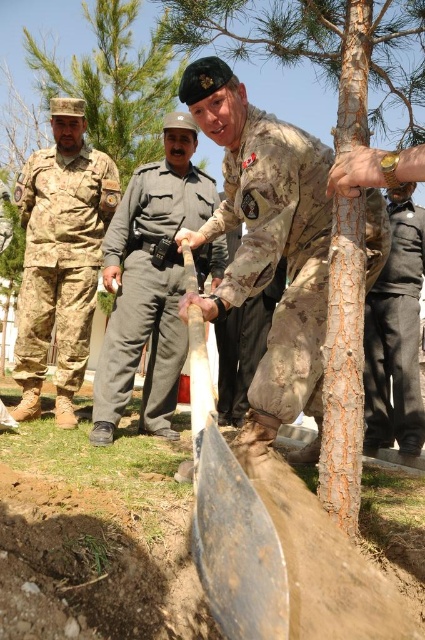
From the picture: Is green textured tree at center positioned at the back of dark gray cotton pants at center?

Yes, green textured tree at center is behind dark gray cotton pants at center.

Is point (53, 68) positioned before point (422, 433)?

No, it is behind (422, 433).

Where is `green textured tree at center`? green textured tree at center is located at coordinates (115, 83).

Does camouflage fabric uniform at center appear on the left side of gray cotton shirt at center?

Incorrect, camouflage fabric uniform at center is not on the left side of gray cotton shirt at center.

This screenshot has height=640, width=425. Describe the element at coordinates (280, 253) in the screenshot. I see `camouflage fabric uniform at center` at that location.

The width and height of the screenshot is (425, 640). I want to click on camouflage fabric uniform at center, so click(280, 253).

Does rusty metal shovel at center appear over green textured tree at center?

No, rusty metal shovel at center is not above green textured tree at center.

Is point (255, 563) positioned before point (53, 61)?

Yes.

The height and width of the screenshot is (640, 425). Describe the element at coordinates (231, 522) in the screenshot. I see `rusty metal shovel at center` at that location.

Locate an element on the screen. This screenshot has width=425, height=640. rusty metal shovel at center is located at coordinates (231, 522).